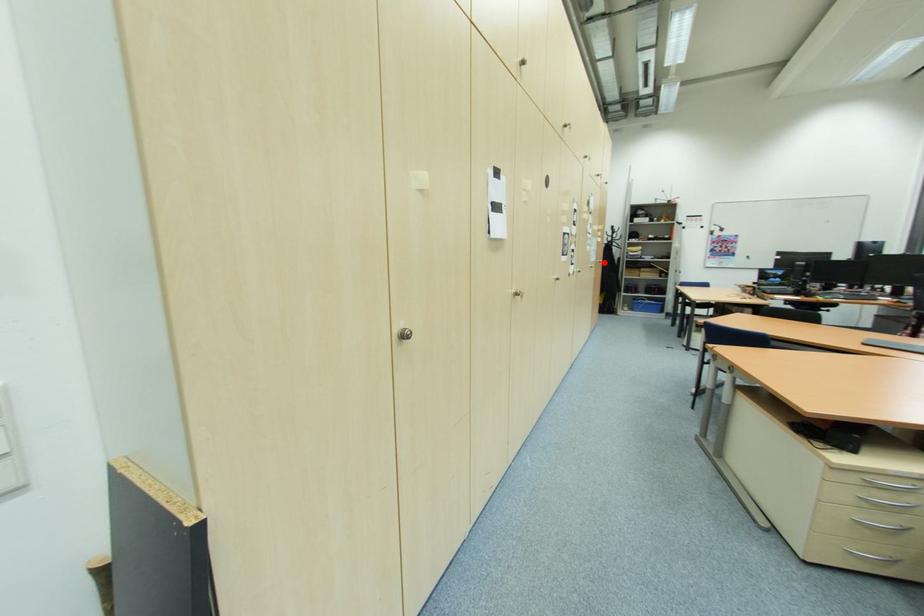
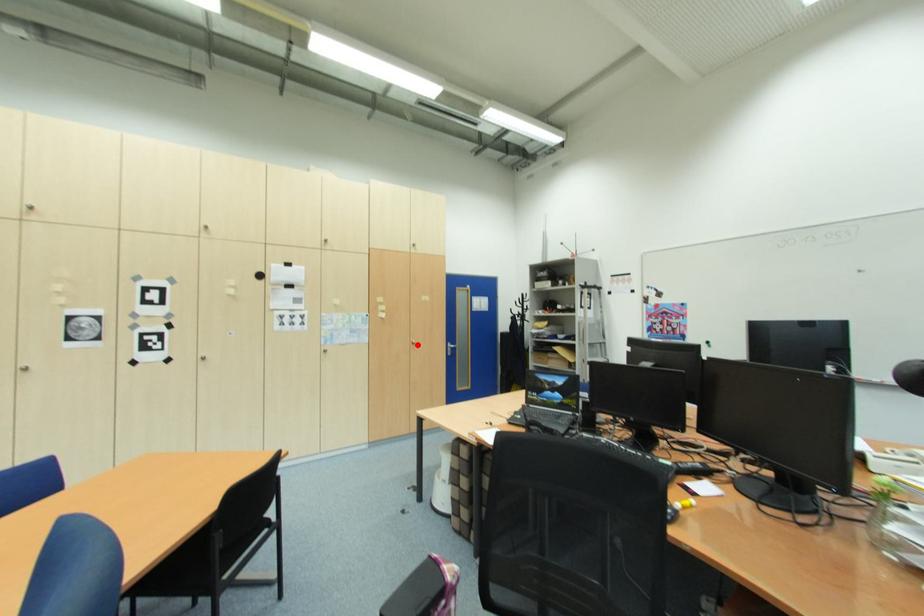
I am providing you with two images of the same scene from different viewpoints. A red point is marked on the first image and another point is marked on the second image. Is the marked point in image1 the same physical position as the marked point in image2?

Yes